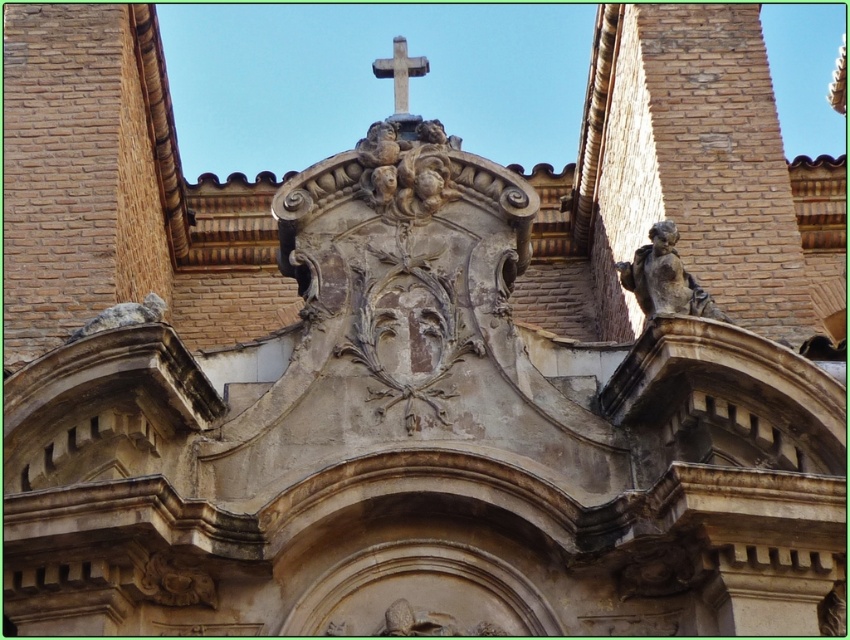
Question: Which point appears farthest from the camera in this image?

Choices:
 (A) (394, 68)
 (B) (646, 301)

Answer: (A)

Question: Can you confirm if stone statue at right is positioned to the left of white stone cross at upper center?

Choices:
 (A) no
 (B) yes

Answer: (A)

Question: In this image, where is stone statue at right located relative to white stone cross at upper center?

Choices:
 (A) right
 (B) left

Answer: (A)

Question: Which point appears closest to the camera in this image?

Choices:
 (A) (672, 253)
 (B) (384, 68)

Answer: (A)

Question: Can you confirm if stone statue at right is bigger than white stone cross at upper center?

Choices:
 (A) yes
 (B) no

Answer: (B)